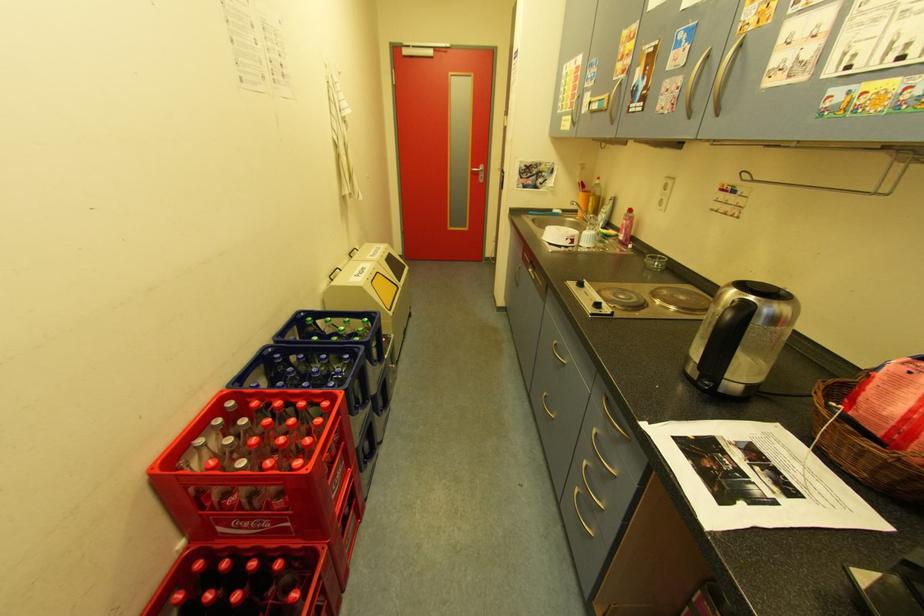
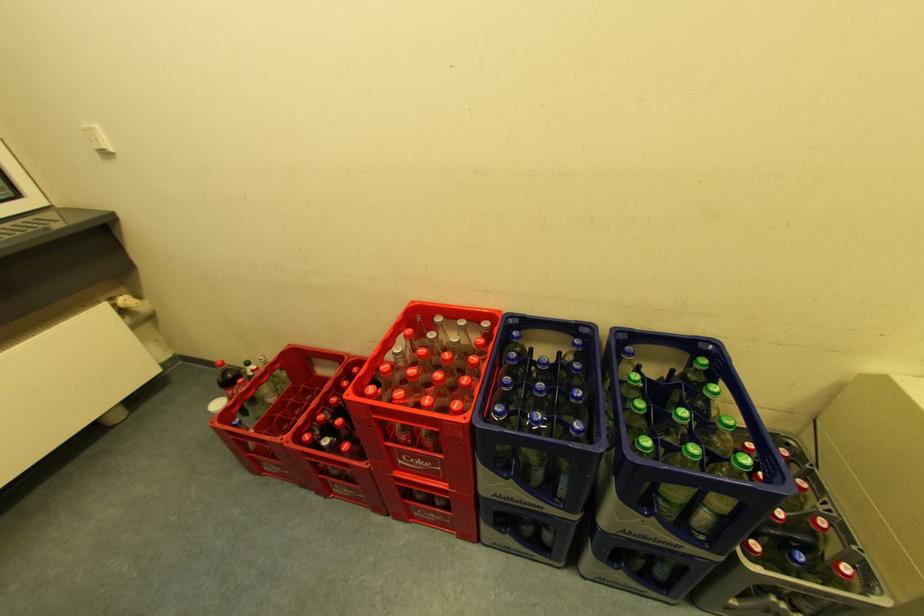
The images are taken continuously from a first-person perspective. In which direction is your viewpoint rotating?

The camera's rotation is toward left-down.